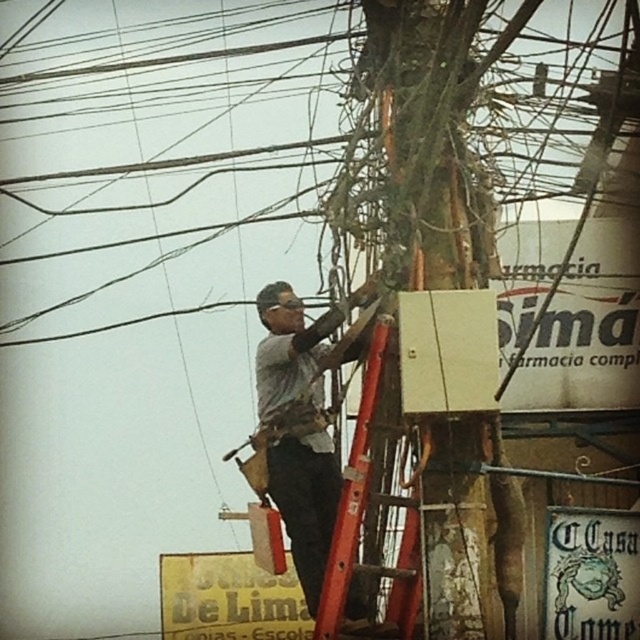
You are a utility worker standing on the ground looking at the green mossy tree trunk at center and the red metal ladder at center. Which object is nearer to you?

Answer: The green mossy tree trunk at center is closer to the viewer than the red metal ladder at center, so the green mossy tree trunk at center is nearer to you.

You are a utility worker standing at the base of the utility pole where the red ladder is placed. You need to reach the green mossy tree trunk at center that is 39.66 meters away. Can you safely climb the red ladder to reach it?

The green mossy tree trunk at center is 39.66 meters away from the viewer. Since the ladder is placed against the utility pole, which is much closer than 39.66 meters, you cannot reach the tree trunk by climbing the ladder.

You are a utility worker needing to climb the red metal ladder at center to reach the utility pole. However, you notice the green mossy tree trunk at center nearby. Which side of the ladder should you avoid to prevent slipping due to the tree trunk?

The green mossy tree trunk at center is positioned on the right side of red metal ladder at center, so you should avoid the right side of the ladder to prevent slipping due to the tree trunk.